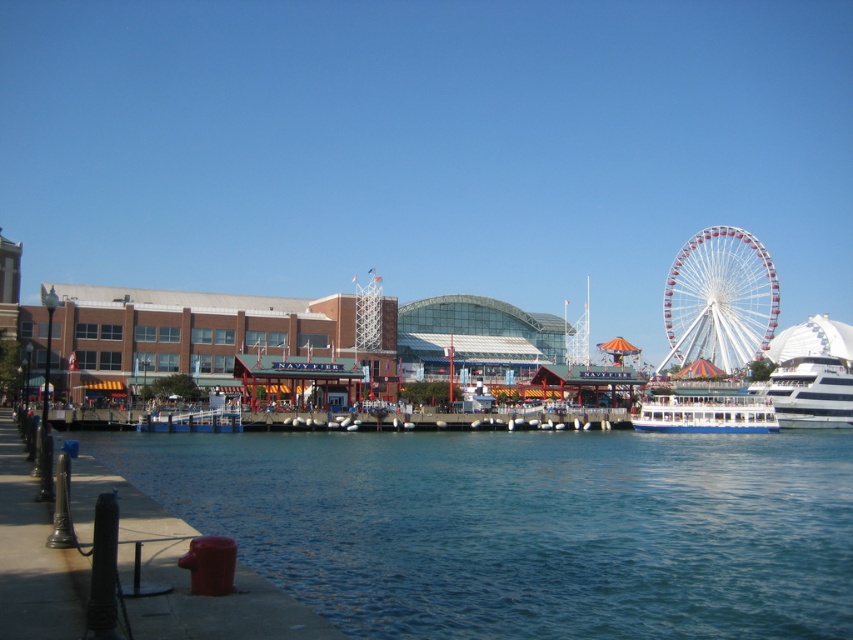
What are the coordinates of the clear blue water at lower center in the image?

The coordinates of the clear blue water at lower center are at point (x=524, y=525).

You are standing at the point with coordinates point (643, 416) and want to walk towards the point with coordinates point (833, 396). Which direction should you face to walk towards the desired point?

You should face towards the direction of the point (833, 396), which is behind point (643, 416), so you need to walk backward to reach it.

You are standing on the pier at Navy Pier and see the clear blue water at lower center and the white metallic ferris wheel at right. Which object is located below the other?

The clear blue water at lower center is positioned under the white metallic ferris wheel at right, so the water is below the ferris wheel.